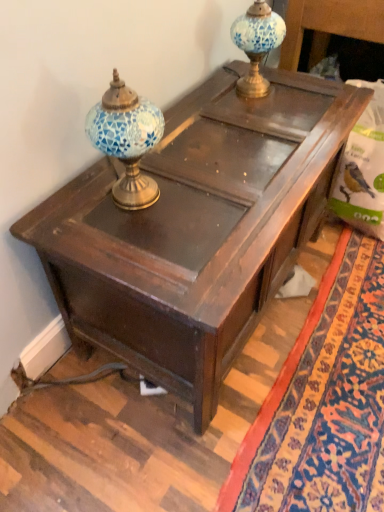
Where is `free point behind blue mosaic glass lamp at upper left, the 2th candle holder from the back`? free point behind blue mosaic glass lamp at upper left, the 2th candle holder from the back is located at coordinates (170, 153).